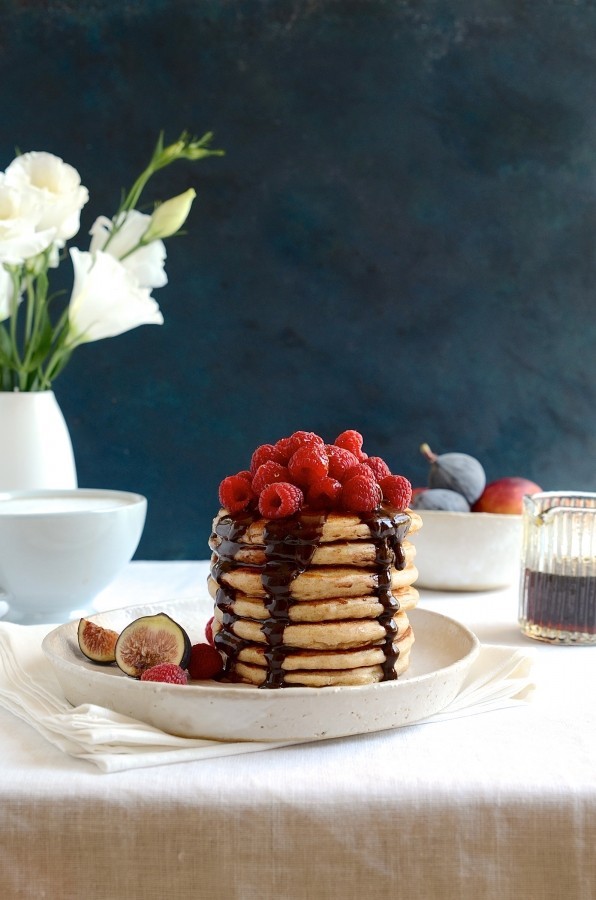
The image size is (596, 900). I want to click on plate, so click(x=248, y=704).